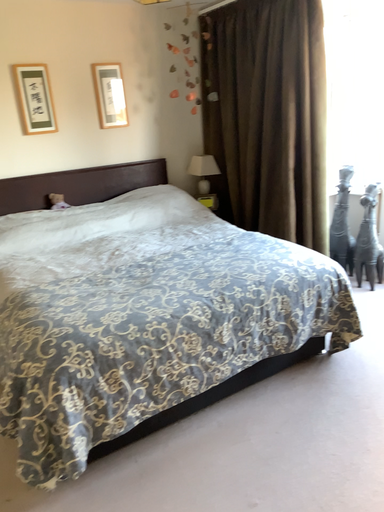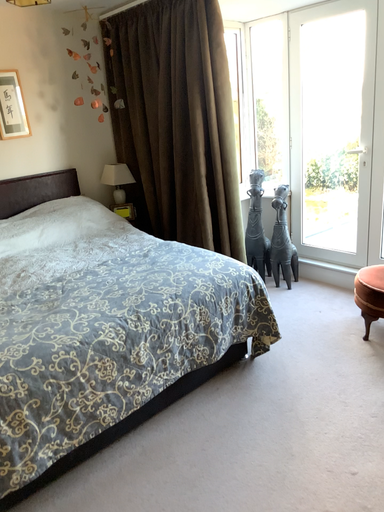
Question: Which way did the camera rotate in the video?

Choices:
 (A) rotated left
 (B) rotated right

Answer: (B)